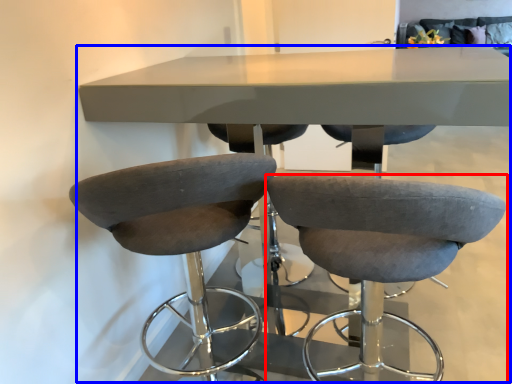
Question: Which object appears closest to the camera in this image, chair (highlighted by a red box) or table (highlighted by a blue box)?

Choices:
 (A) chair
 (B) table

Answer: (A)